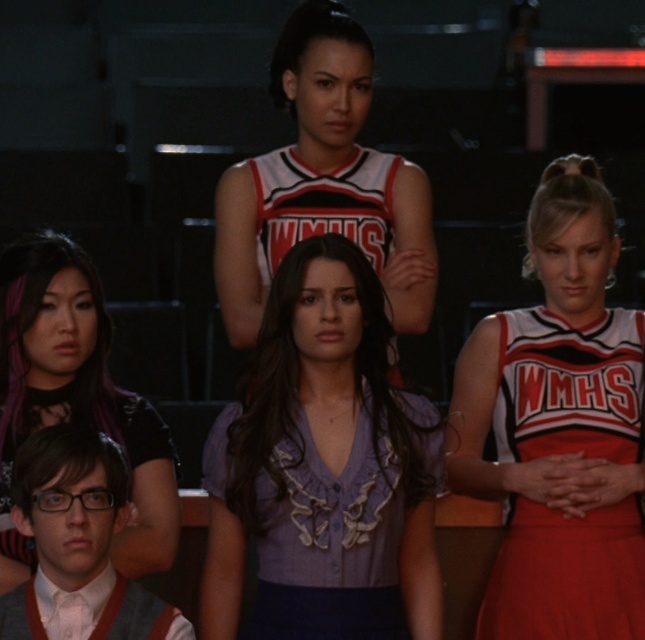
Does red fabric cheerleader uniform at center appear on the right side of shiny purple hair at lower left?

Indeed, red fabric cheerleader uniform at center is positioned on the right side of shiny purple hair at lower left.

Can you confirm if red fabric cheerleader uniform at center is positioned above shiny purple hair at lower left?

No, red fabric cheerleader uniform at center is not above shiny purple hair at lower left.

This screenshot has height=640, width=645. What do you see at coordinates (570, 387) in the screenshot?
I see `red fabric cheerleader uniform at center` at bounding box center [570, 387].

Where is `red fabric cheerleader uniform at center`? red fabric cheerleader uniform at center is located at coordinates (570, 387).

Between purple satin blouse at center and red fabric cheerleader uniform at center, which one has more height?

purple satin blouse at center is taller.

Does point (286, 333) lie in front of point (541, 400)?

Yes.

Identify the location of purple satin blouse at center. Image resolution: width=645 pixels, height=640 pixels. (324, 467).

Between point (281, 88) and point (48, 604), which one is positioned behind?

The point (281, 88) is behind.

Which is behind, point (361, 170) or point (21, 624)?

The point (361, 170) is behind.

This screenshot has height=640, width=645. Identify the location of white jersey at center. (322, 180).